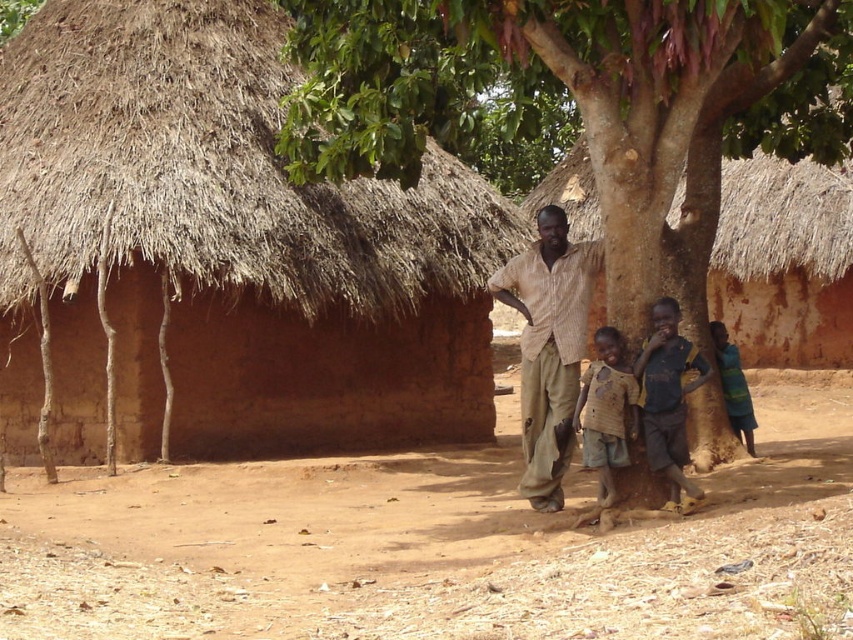
Does brown sandy dirt at lower center have a lesser width compared to brown textured shirt at center?

No, brown sandy dirt at lower center is not thinner than brown textured shirt at center.

Between brown sandy dirt at lower center and brown textured shirt at center, which one appears on the left side from the viewer's perspective?

Positioned to the left is brown sandy dirt at lower center.

Does point (413, 561) come in front of point (583, 456)?

That is True.

Identify the location of brown sandy dirt at lower center. The width and height of the screenshot is (853, 640). (432, 547).

Describe the element at coordinates (782, 220) in the screenshot. I see `thatched straw roof at upper center` at that location.

Does thatched straw roof at upper center appear under dark blue jersey at center?

No, thatched straw roof at upper center is not below dark blue jersey at center.

Is point (543, 195) in front of point (663, 301)?

No, (543, 195) is further to viewer.

Identify the location of thatched straw roof at upper center. Image resolution: width=853 pixels, height=640 pixels. (782, 220).

Is thatched straw roof at upper center taller than light brown striped shirt at center?

No.

Measure the distance between thatched straw roof at upper center and light brown striped shirt at center.

A distance of 11.37 meters exists between thatched straw roof at upper center and light brown striped shirt at center.

Does point (744, 161) come behind point (569, 332)?

Yes.

What are the coordinates of `thatched straw roof at upper center` in the screenshot? It's located at (782, 220).